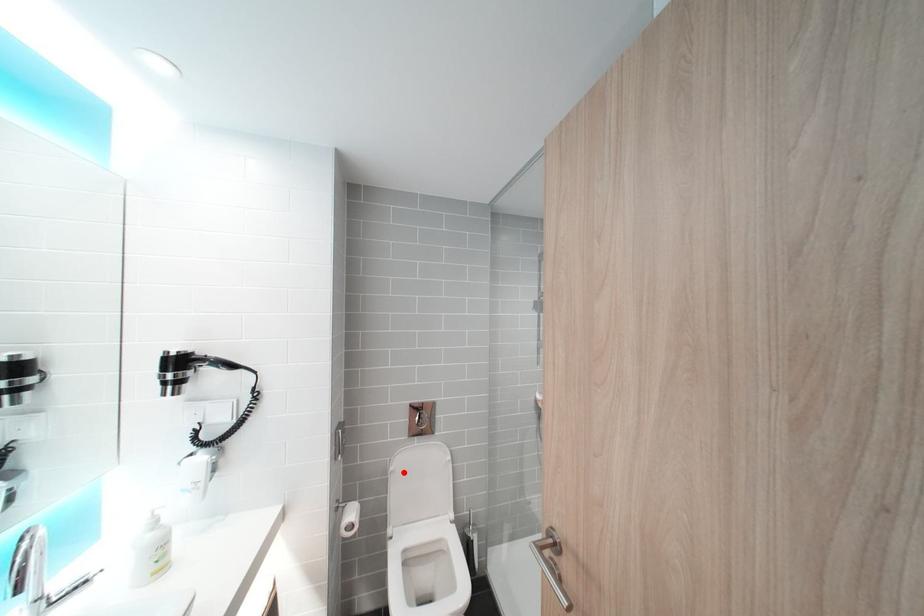
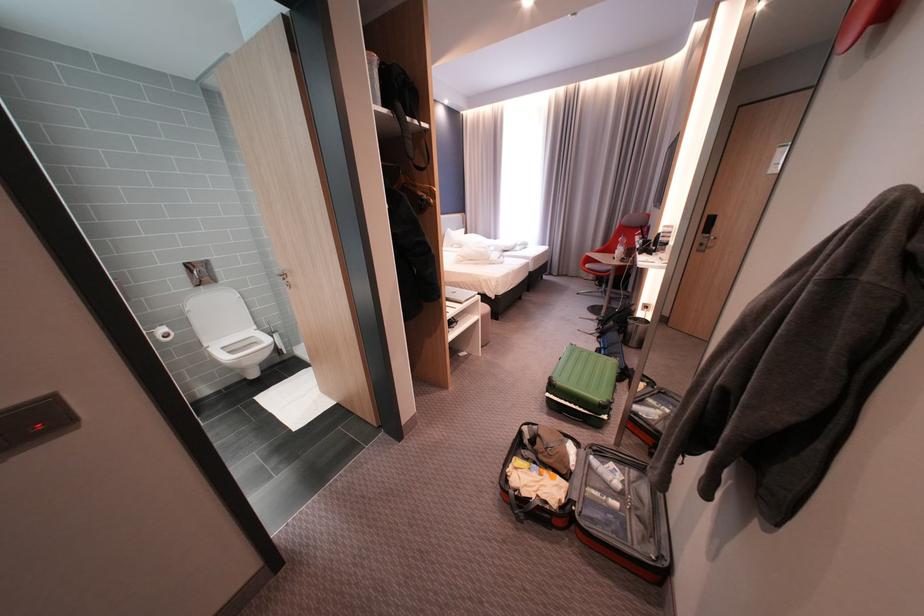
Question: I am providing you with two images of the same scene from different viewpoints. A red point is shown in image1. For the corresponding object point in image2, is it positioned nearer or farther from the camera?

Choices:
 (A) Nearer
 (B) Farther

Answer: (A)